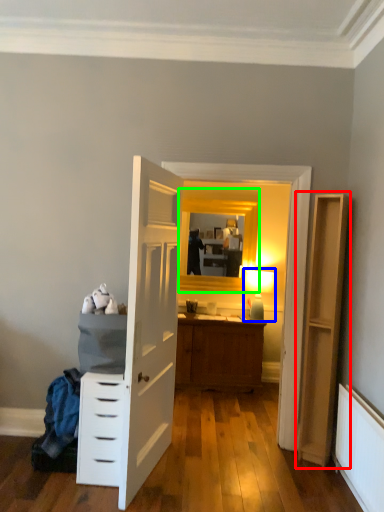
Question: Which is farther away from file cabinet (highlighted by a red box)? light fixture (highlighted by a blue box) or window (highlighted by a green box)?

Choices:
 (A) light fixture
 (B) window

Answer: (B)